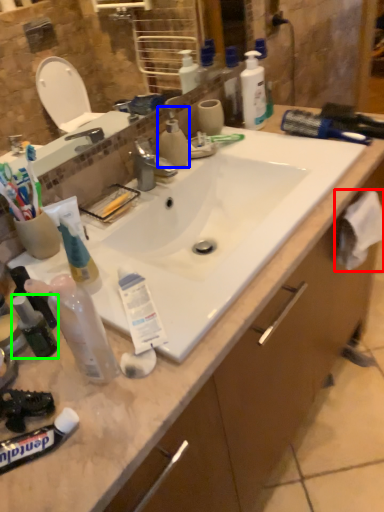
Question: Which object is the farthest from toilet paper (highlighted by a red box)? Choose among these: cleaning product (highlighted by a blue box) or mouthwash (highlighted by a green box).

Choices:
 (A) cleaning product
 (B) mouthwash

Answer: (B)